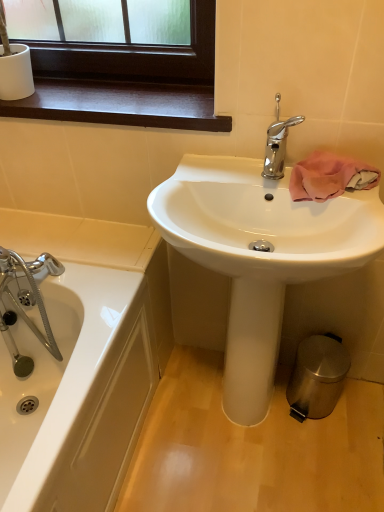
Where is `free space above metallic silver trash can at lower right (from a real-world perspective)`? The height and width of the screenshot is (512, 384). free space above metallic silver trash can at lower right (from a real-world perspective) is located at coordinates (226, 442).